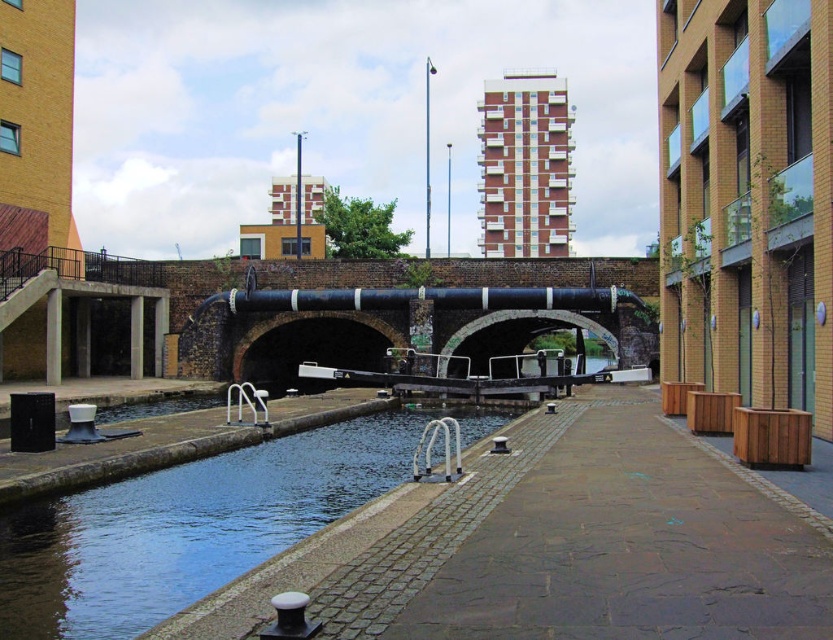
You are a delivery person who needs to cross the canal using the black concrete bridge at center. However, your delivery cart is 1.2 meters tall. Can your cart pass under the smooth concrete river at center without hitting the bridge?

The smooth concrete river at center has a lesser height compared to the black concrete bridge at center, meaning the river is lower than the bridge. Since the cart is 1.2 meters tall, it should be able to pass under the bridge as the river is lower and the bridge is higher, providing enough clearance.